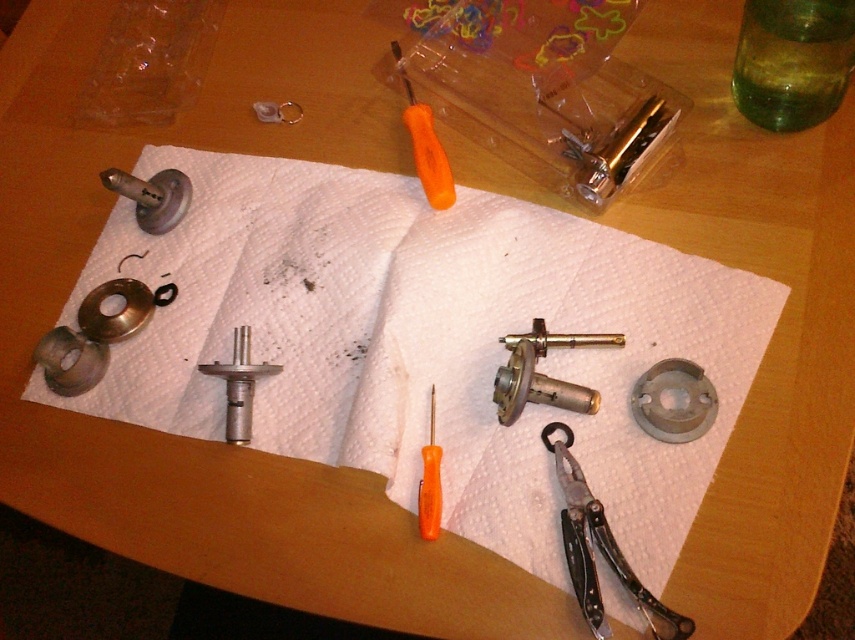
Does black plastic scissors at lower right lie in front of matte silver cylinder at upper left?

Yes, black plastic scissors at lower right is closer to the viewer.

Can you confirm if black plastic scissors at lower right is taller than matte silver cylinder at upper left?

Yes.

Identify the location of black plastic scissors at lower right. Image resolution: width=855 pixels, height=640 pixels. (599, 550).

Find the location of a particular element. The height and width of the screenshot is (640, 855). black plastic scissors at lower right is located at coordinates (599, 550).

Does black plastic scissors at lower right have a lesser width compared to orange plastic screwdriver at center?

No, black plastic scissors at lower right is not thinner than orange plastic screwdriver at center.

From the picture: Between black plastic scissors at lower right and orange plastic screwdriver at center, which one appears on the right side from the viewer's perspective?

black plastic scissors at lower right

This screenshot has width=855, height=640. Identify the location of black plastic scissors at lower right. (599, 550).

In order to click on black plastic scissors at lower right in this screenshot , I will do `click(599, 550)`.

Can you confirm if metallic/brass/valve at center is positioned to the right of metallic gold razor at upper center?

Incorrect, metallic/brass/valve at center is not on the right side of metallic gold razor at upper center.

This screenshot has width=855, height=640. What do you see at coordinates (541, 372) in the screenshot?
I see `metallic/brass/valve at center` at bounding box center [541, 372].

Identify the location of metallic/brass/valve at center. The image size is (855, 640). (541, 372).